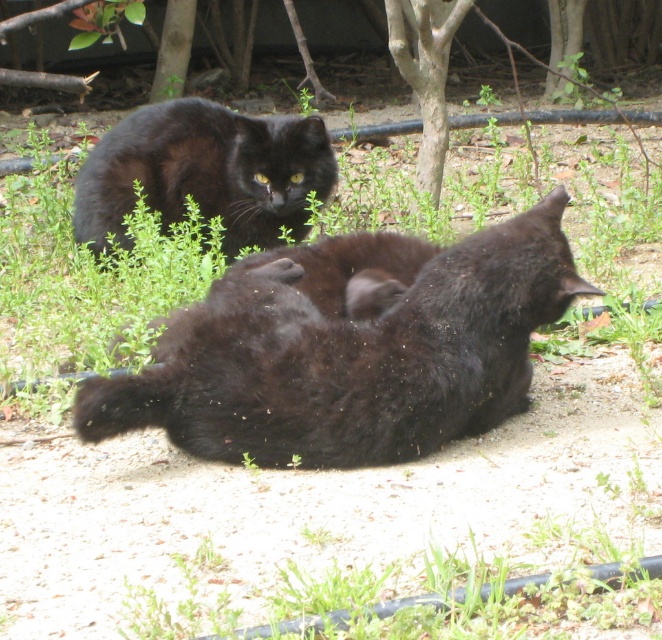
Looking at this image, you are a photographer trying to capture both the shiny black cat at upper left and the smooth bark tree at center in a single frame. Based on their sizes, which object should you focus on first to ensure both fit in the shot?

The shiny black cat at upper left is wider than the smooth bark tree at center. To ensure both fit in the shot, focus on framing the wider object first, which is the shiny black cat at upper left, then adjust to include the smooth bark tree at center.

You are a photographer trying to capture the shiny black cat at upper left. To get a clear shot of the cat without the tree blocking the view, should you move to the left or right of the smooth bark tree at center?

The shiny black cat at upper left is positioned under the smooth bark tree at center, so moving to the right of the smooth bark tree at center would allow you to avoid the tree blocking the view.

You are standing in the garden where the two cats are. You want to throw a small ball to the point closer to you between point (x=426, y=416) and point (x=442, y=60). Which point should you aim for?

You should aim for point (x=426, y=416) because it is closer to you than point (x=442, y=60).